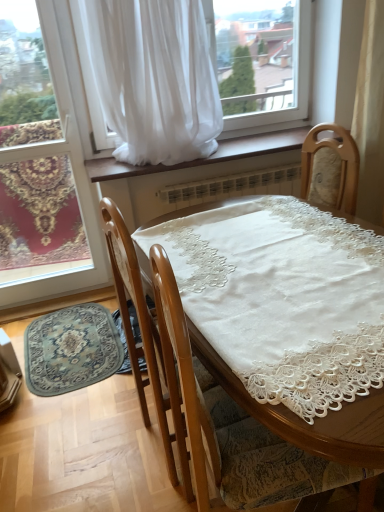
Question: Should I look upward or downward to see matte glass window at lower left?

Choices:
 (A) up
 (B) down

Answer: (A)

Question: Does blue patterned rug at lower left lie behind wooden chair at center?

Choices:
 (A) yes
 (B) no

Answer: (A)

Question: Does blue patterned rug at lower left have a lesser height compared to wooden chair at center?

Choices:
 (A) no
 (B) yes

Answer: (B)

Question: Considering the relative sizes of blue patterned rug at lower left and wooden chair at center in the image provided, is blue patterned rug at lower left bigger than wooden chair at center?

Choices:
 (A) no
 (B) yes

Answer: (A)

Question: Could wooden chair at center be considered to be inside blue patterned rug at lower left?

Choices:
 (A) yes
 (B) no

Answer: (B)

Question: From the image's perspective, does blue patterned rug at lower left appear higher than wooden chair at center?

Choices:
 (A) yes
 (B) no

Answer: (B)

Question: Considering the relative sizes of blue patterned rug at lower left and wooden chair at center in the image provided, is blue patterned rug at lower left wider than wooden chair at center?

Choices:
 (A) yes
 (B) no

Answer: (B)

Question: Is matte glass window at lower left not within brown wood at center?

Choices:
 (A) yes
 (B) no

Answer: (A)

Question: Can you confirm if matte glass window at lower left is shorter than brown wood at center?

Choices:
 (A) no
 (B) yes

Answer: (A)

Question: Can you confirm if matte glass window at lower left is wider than brown wood at center?

Choices:
 (A) no
 (B) yes

Answer: (A)

Question: Is matte glass window at lower left with brown wood at center?

Choices:
 (A) yes
 (B) no

Answer: (B)

Question: Is matte glass window at lower left facing away from brown wood at center?

Choices:
 (A) yes
 (B) no

Answer: (B)

Question: From the image's perspective, is matte glass window at lower left over brown wood at center?

Choices:
 (A) yes
 (B) no

Answer: (B)

Question: Does white sheer curtain at upper center appear on the left side of brown wood at center?

Choices:
 (A) no
 (B) yes

Answer: (B)